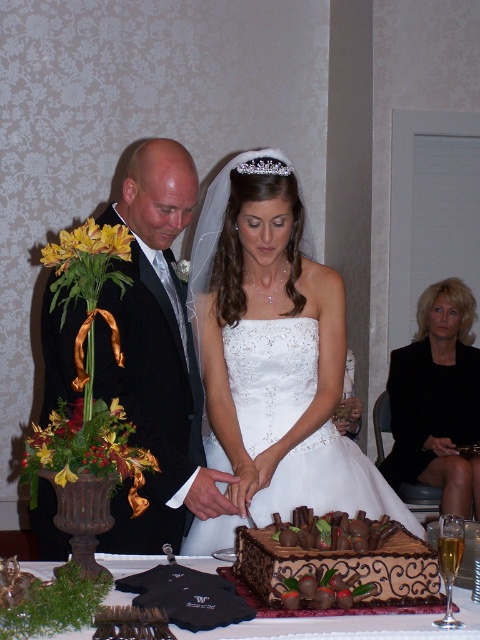
Is chocolate-frosted rectangular cake at center smaller than dark brown wood cake at center?

Correct, chocolate-frosted rectangular cake at center occupies less space than dark brown wood cake at center.

Can you confirm if chocolate-frosted rectangular cake at center is positioned to the left of dark brown wood cake at center?

Incorrect, chocolate-frosted rectangular cake at center is not on the left side of dark brown wood cake at center.

The width and height of the screenshot is (480, 640). Describe the element at coordinates (336, 563) in the screenshot. I see `chocolate-frosted rectangular cake at center` at that location.

The image size is (480, 640). Identify the location of chocolate-frosted rectangular cake at center. (336, 563).

I want to click on black fabric dress at lower right, so click(437, 400).

Is black fabric dress at lower right shorter than chocolate-frosted rectangular cake at center?

No, black fabric dress at lower right is not shorter than chocolate-frosted rectangular cake at center.

Image resolution: width=480 pixels, height=640 pixels. I want to click on black fabric dress at lower right, so click(x=437, y=400).

From the picture: Is black fabric dress at lower right shorter than dark brown wood cake at center?

In fact, black fabric dress at lower right may be taller than dark brown wood cake at center.

This screenshot has width=480, height=640. Describe the element at coordinates (437, 400) in the screenshot. I see `black fabric dress at lower right` at that location.

Measure the distance between black fabric dress at lower right and camera.

10.32 feet

Image resolution: width=480 pixels, height=640 pixels. Identify the location of black fabric dress at lower right. (437, 400).